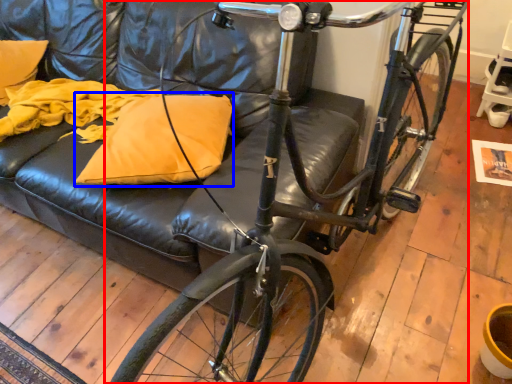
Question: Which object is further to the camera taking this photo, bicycle (highlighted by a red box) or pillow (highlighted by a blue box)?

Choices:
 (A) bicycle
 (B) pillow

Answer: (B)